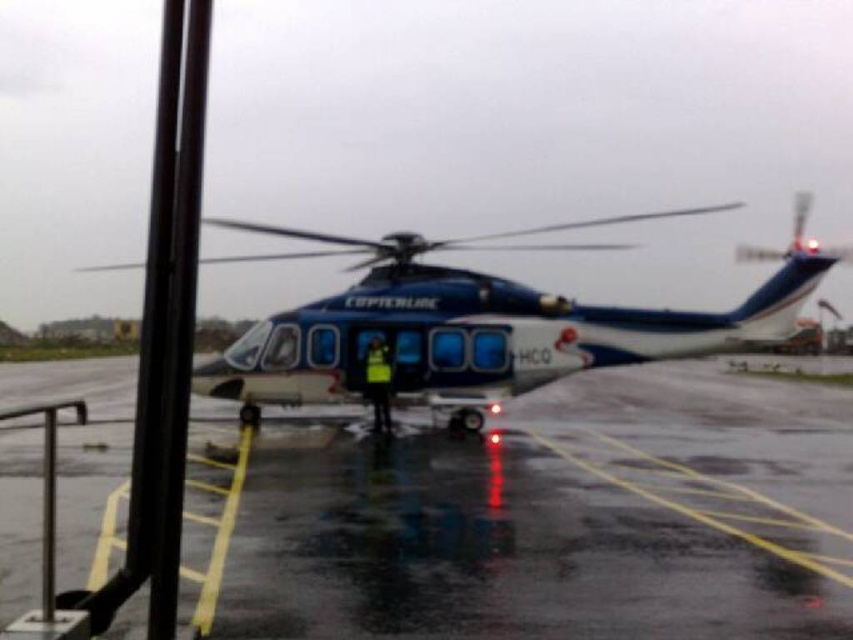
Looking at this image, who is higher up, glossy asphalt tarmac at center or blue glossy helicopter at center?

blue glossy helicopter at center is above.

Does point (379, 600) come behind point (453, 380)?

No, (379, 600) is in front of (453, 380).

Locate an element on the screen. This screenshot has width=853, height=640. glossy asphalt tarmac at center is located at coordinates (546, 518).